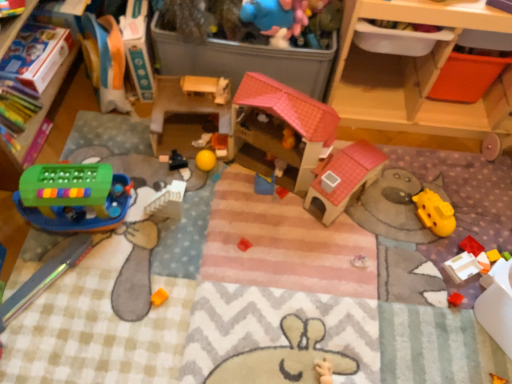
Question: From a real-world perspective, is wooden drawer at upper right located higher than yellow rubber ball at center, the fifth toy in the right-to-left sequence?

Choices:
 (A) yes
 (B) no

Answer: (A)

Question: Does wooden drawer at upper right have a lesser width compared to yellow rubber ball at center, the fifth toy in the right-to-left sequence?

Choices:
 (A) no
 (B) yes

Answer: (A)

Question: Considering the relative positions of wooden drawer at upper right and yellow rubber ball at center, which is counted as the fifth toy, starting from the left, in the image provided, is wooden drawer at upper right to the right of yellow rubber ball at center, which is counted as the fifth toy, starting from the left, from the viewer's perspective?

Choices:
 (A) yes
 (B) no

Answer: (A)

Question: From the image's perspective, is wooden drawer at upper right above yellow rubber ball at center, which is counted as the fifth toy, starting from the left?

Choices:
 (A) yes
 (B) no

Answer: (A)

Question: Is the position of wooden drawer at upper right more distant than that of yellow rubber ball at center, which is counted as the fifth toy, starting from the left?

Choices:
 (A) yes
 (B) no

Answer: (B)

Question: From the image's perspective, is yellow plastic spoon at center, the 7th toy when ordered from left to right, positioned above or below yellow rubber ball at center, which is counted as the fifth toy, starting from the left?

Choices:
 (A) below
 (B) above

Answer: (A)

Question: Considering the positions of yellow plastic spoon at center, marked as the 3th toy in a right-to-left arrangement, and yellow rubber ball at center, the fifth toy in the right-to-left sequence, in the image, is yellow plastic spoon at center, marked as the 3th toy in a right-to-left arrangement, taller or shorter than yellow rubber ball at center, the fifth toy in the right-to-left sequence,?

Choices:
 (A) short
 (B) tall

Answer: (A)

Question: Considering the positions of point (256, 190) and point (210, 162), is point (256, 190) closer or farther from the camera than point (210, 162)?

Choices:
 (A) closer
 (B) farther

Answer: (A)

Question: In the image, is yellow plastic spoon at center, marked as the 3th toy in a right-to-left arrangement, on the left side or the right side of yellow rubber ball at center, which is counted as the fifth toy, starting from the left?

Choices:
 (A) left
 (B) right

Answer: (B)

Question: From a real-world perspective, relative to white plastic block at lower right, the 2th toy positioned from the right, is metallic blue car at center, which appears as the 8th toy when viewed from the right, vertically above or below?

Choices:
 (A) above
 (B) below

Answer: (A)

Question: Considering the relative positions of metallic blue car at center, which is the 2th toy from left to right, and white plastic block at lower right, the 2th toy positioned from the right, in the image provided, is metallic blue car at center, which is the 2th toy from left to right, to the left or to the right of white plastic block at lower right, the 2th toy positioned from the right,?

Choices:
 (A) right
 (B) left

Answer: (B)

Question: In terms of size, does metallic blue car at center, which appears as the 8th toy when viewed from the right, appear bigger or smaller than white plastic block at lower right, acting as the eighth toy starting from the left?

Choices:
 (A) small
 (B) big

Answer: (A)

Question: Is point (180, 165) positioned closer to the camera than point (445, 263)?

Choices:
 (A) closer
 (B) farther

Answer: (B)

Question: Looking at the image, does white matte figurine at center, arranged as the sixth toy when viewed from the right, seem bigger or smaller compared to yellow rubber ball at center, which appears as the sixth toy when viewed from the left?

Choices:
 (A) small
 (B) big

Answer: (A)

Question: Considering the relative positions of white matte figurine at center, which ranks as the 4th toy in left-to-right order, and yellow rubber ball at center, which is counted as the 4th toy, starting from the right, in the image provided, is white matte figurine at center, which ranks as the 4th toy in left-to-right order, to the left or to the right of yellow rubber ball at center, which is counted as the 4th toy, starting from the right,?

Choices:
 (A) left
 (B) right

Answer: (A)